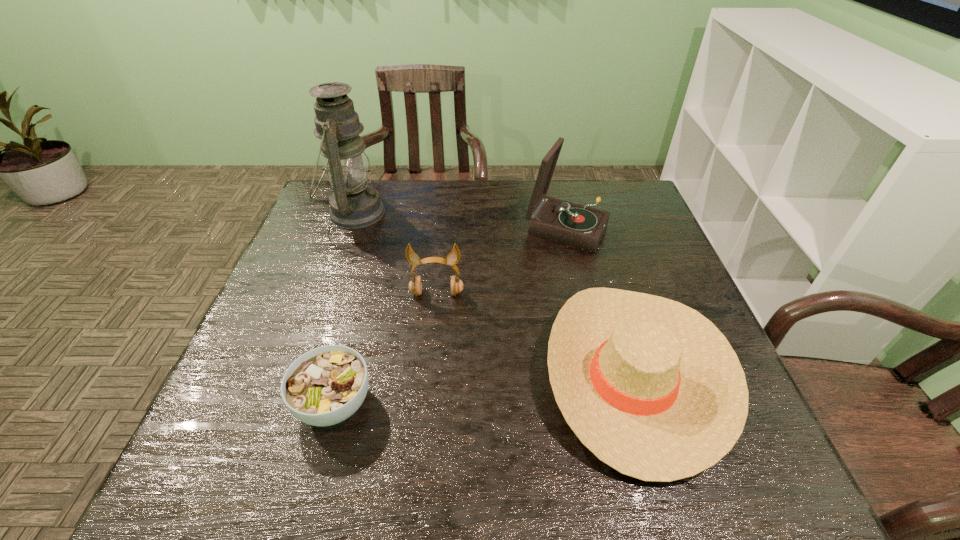
The image size is (960, 540). I want to click on vacant space that is in between the shortest object and the phonograph record, so click(450, 316).

Locate an element on the screen. The image size is (960, 540). free space between the oil lamp and the shortest object is located at coordinates (345, 308).

Where is `vacant space in between the second shortest object and the tallest object`? The height and width of the screenshot is (540, 960). vacant space in between the second shortest object and the tallest object is located at coordinates (494, 293).

The height and width of the screenshot is (540, 960). In order to click on blank region between the oil lamp and the earphone in this screenshot , I will do `click(396, 253)`.

Locate an element on the screen. free spot between the fourth shortest object and the tallest object is located at coordinates coord(460,221).

Locate an element on the screen. The image size is (960, 540). object that is the fourth closest to the shortest object is located at coordinates (557, 220).

Locate which object ranks fourth in proximity to the sunhat. Please provide its 2D coordinates. Your answer should be formatted as a tuple, i.e. [(x, y)], where the tuple contains the x and y coordinates of a point satisfying the conditions above.

[(353, 204)]

This screenshot has width=960, height=540. In order to click on free space that satisfies the following two spatial constraints: 1. on the front-facing side of the sunhat; 2. on the right side of the third tallest object in this screenshot , I will do `click(429, 374)`.

This screenshot has height=540, width=960. Identify the location of free space that satisfies the following two spatial constraints: 1. on the back side of the shortest object; 2. on the right side of the phonograph record. pyautogui.click(x=382, y=229).

At what (x,y) coordinates should I click in order to perform the action: click on blank area in the image that satisfies the following two spatial constraints: 1. on the front-facing side of the sunhat; 2. on the left side of the third shortest object. Please return your answer as a coordinate pair (x, y). Looking at the image, I should click on (429, 374).